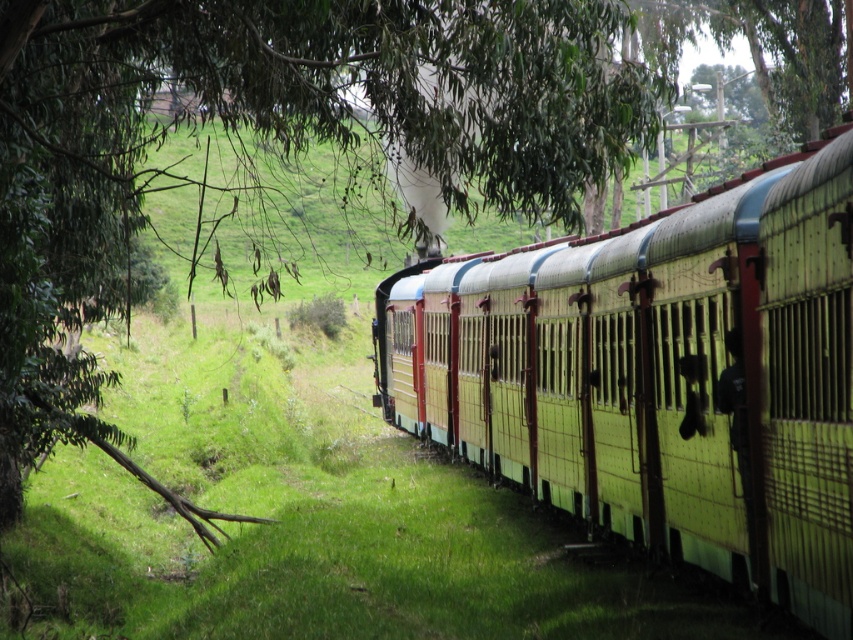
How much distance is there between yellow painted metal train at center and green leafy tree at center?

yellow painted metal train at center and green leafy tree at center are 7.90 meters apart from each other.

From the picture: Which is more to the left, yellow painted metal train at center or green leafy tree at center?

green leafy tree at center

Is point (570, 371) behind point (509, 122)?

Yes, it is.

Locate an element on the screen. yellow painted metal train at center is located at coordinates [659, 376].